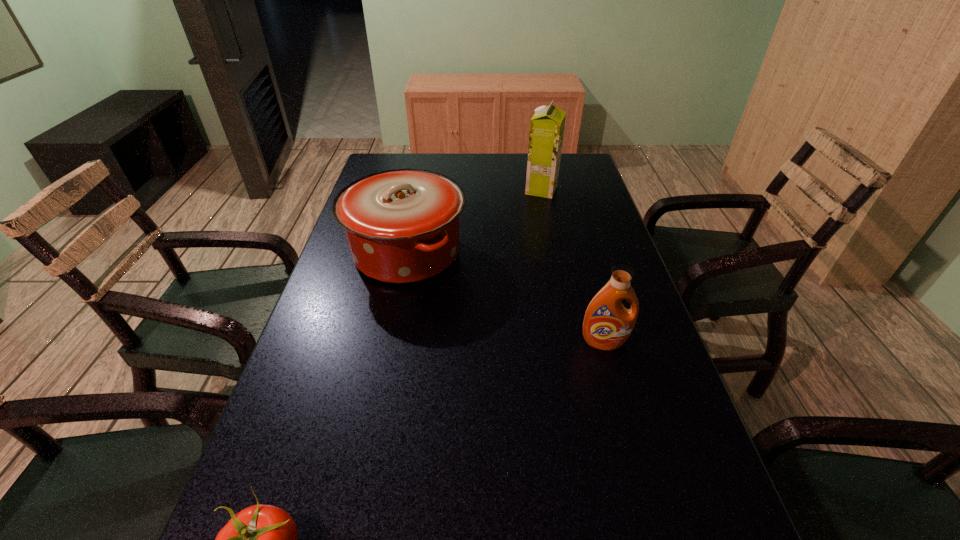
The width and height of the screenshot is (960, 540). Find the location of `vacant space that is in between the soya milk and the casserole`. vacant space that is in between the soya milk and the casserole is located at coordinates (474, 221).

Locate an element on the screen. This screenshot has height=540, width=960. object that ranks as the closest to the soya milk is located at coordinates 402,226.

The width and height of the screenshot is (960, 540). I want to click on object that is the closest to the third farthest object, so click(402, 226).

You are a GUI agent. You are given a task and a screenshot of the screen. Output one action in this format:
    pyautogui.click(x=<x>, y=<y>)
    Task: Click on the free space in the image that satisfies the following two spatial constraints: 1. on the back side of the casserole; 2. on the left side of the soya milk
    
    Given the screenshot: What is the action you would take?
    pyautogui.click(x=420, y=190)